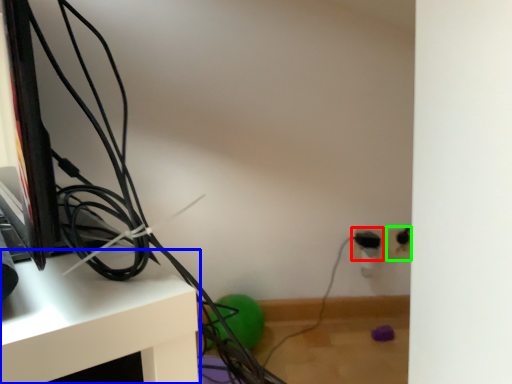
Question: Estimate the real-world distances between objects in this image. Which object is farther from electric outlet (highlighted by a red box), furniture (highlighted by a blue box) or electric outlet (highlighted by a green box)?

Choices:
 (A) furniture
 (B) electric outlet

Answer: (A)